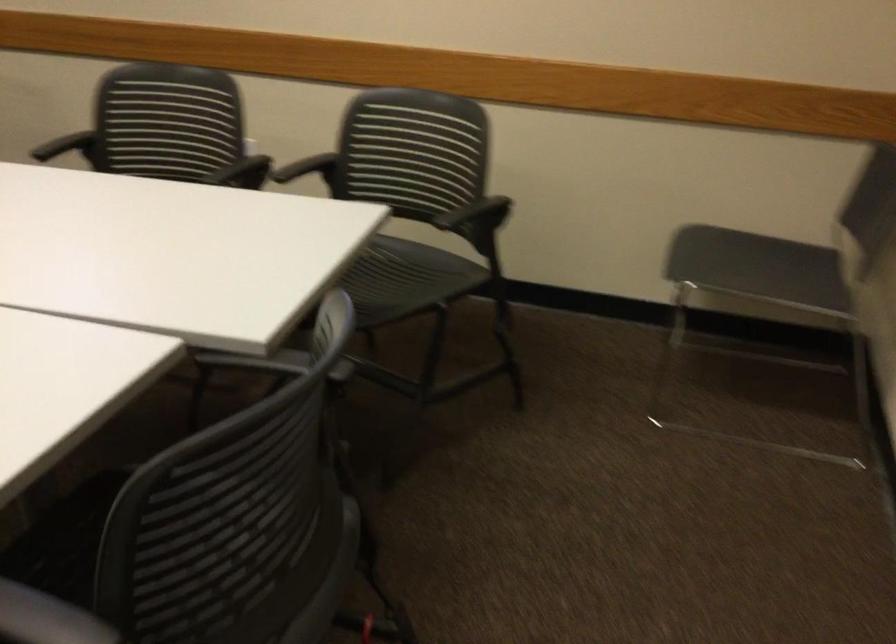
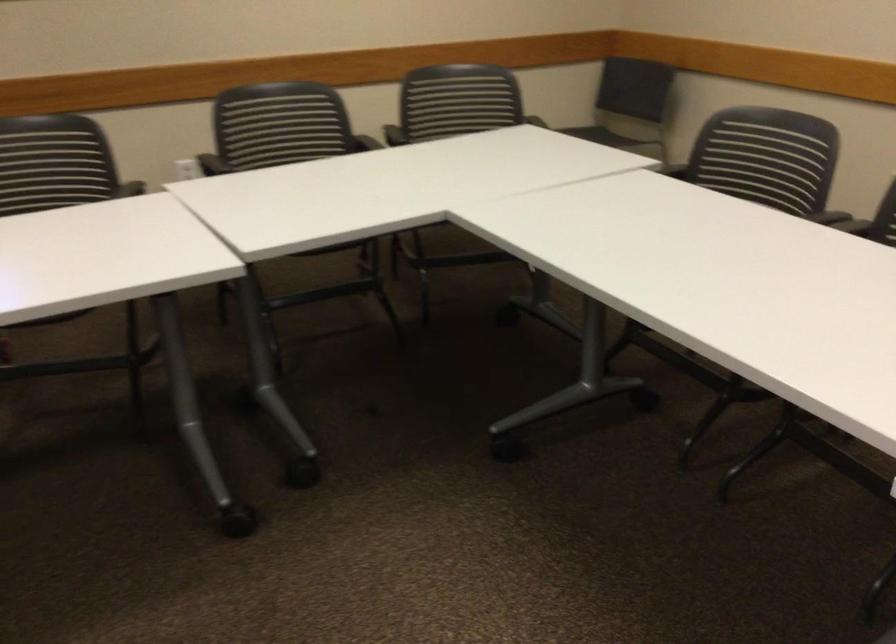
In the second image, find the point that corresponds to (119,136) in the first image.

(211, 164)